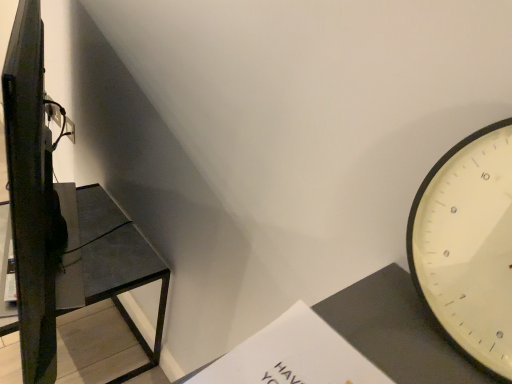
Question: In terms of height, does white paper at lower center look taller or shorter compared to matte black shelf at left?

Choices:
 (A) tall
 (B) short

Answer: (B)

Question: Looking at their shapes, would you say white paper at lower center is wider or thinner than matte black shelf at left?

Choices:
 (A) thin
 (B) wide

Answer: (A)

Question: Would you say white paper at lower center is to the left or to the right of matte black shelf at left in the picture?

Choices:
 (A) right
 (B) left

Answer: (A)

Question: From their relative heights in the image, would you say matte black shelf at left is taller or shorter than white paper at lower center?

Choices:
 (A) tall
 (B) short

Answer: (A)

Question: Looking at their shapes, would you say matte black shelf at left is wider or thinner than white paper at lower center?

Choices:
 (A) thin
 (B) wide

Answer: (B)

Question: In the image, is matte black shelf at left positioned in front of or behind white paper at lower center?

Choices:
 (A) front
 (B) behind

Answer: (B)

Question: From a real-world perspective, is matte black shelf at left positioned above or below white paper at lower center?

Choices:
 (A) below
 (B) above

Answer: (A)